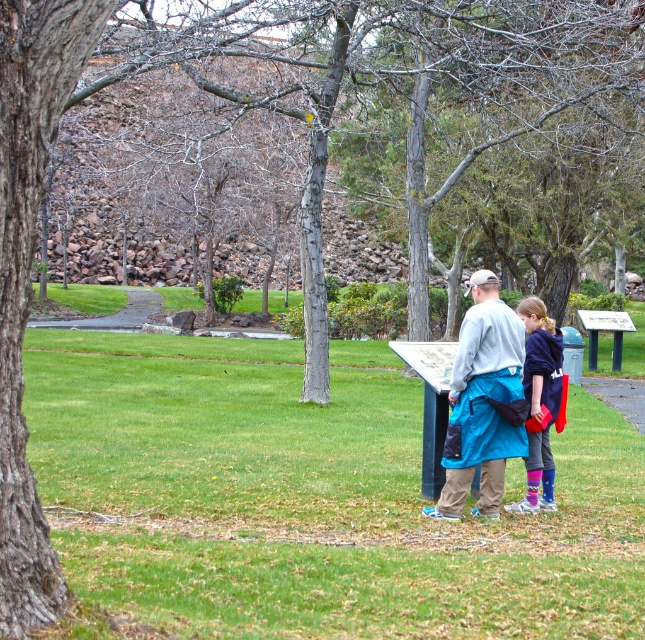
Is blue fabric jacket at center below paved stone path at center?

Yes.

Who is more distant from viewer, (482, 403) or (126, 289)?

Point (126, 289)

This screenshot has height=640, width=645. I want to click on blue fabric jacket at center, so click(x=482, y=403).

Who is positioned more to the left, blue denim jacket at center or paved stone path at center?

paved stone path at center

Who is shorter, blue denim jacket at center or paved stone path at center?

blue denim jacket at center

Between point (544, 314) and point (97, 321), which one is positioned in front?

Point (544, 314)

What are the coordinates of `blue denim jacket at center` in the screenshot? It's located at (539, 401).

Can you confirm if blue fabric jacket at center is thinner than blue denim jacket at center?

No.

Which is above, blue fabric jacket at center or blue denim jacket at center?

blue denim jacket at center

Is point (499, 432) more distant than point (528, 432)?

No.

The image size is (645, 640). Identify the location of blue fabric jacket at center. (482, 403).